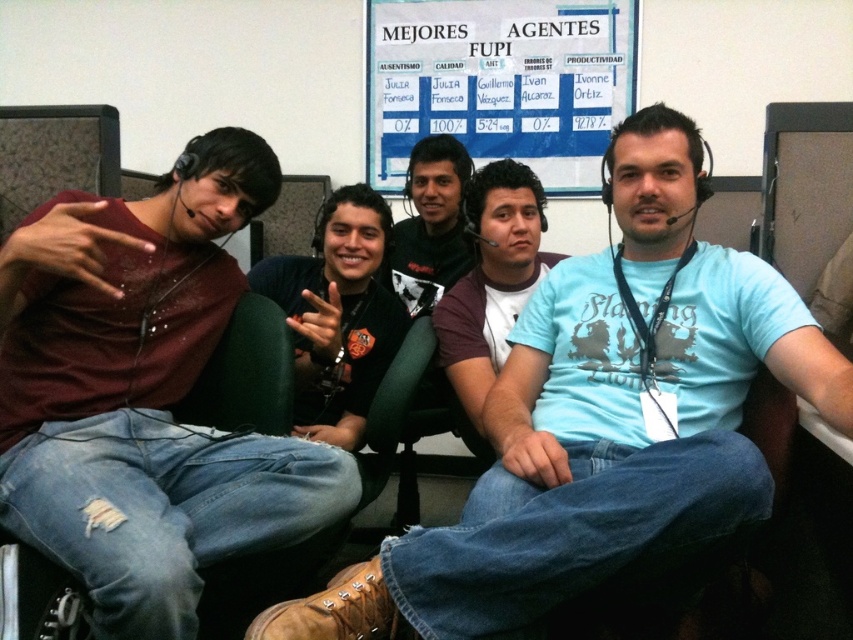
Which is behind, point (270, 621) or point (538, 61)?

The point (538, 61) is behind.

Where is `light blue t-shirt at center`? The width and height of the screenshot is (853, 640). light blue t-shirt at center is located at coordinates (589, 412).

Is point (361, 600) farther from camera compared to point (477, 22)?

No.

Where is `light blue t-shirt at center`? light blue t-shirt at center is located at coordinates (589, 412).

Is matte maroon shirt at left positioned before maroon fabric shirt at center?

Yes, matte maroon shirt at left is in front of maroon fabric shirt at center.

Between point (256, 156) and point (463, 189), which one is positioned behind?

Positioned behind is point (463, 189).

Which is behind, point (212, 284) or point (469, 298)?

The point (469, 298) is more distant.

You are a GUI agent. You are given a task and a screenshot of the screen. Output one action in this format:
    pyautogui.click(x=<x>, y=<y>)
    Task: Click on the matte maroon shirt at left
    Image resolution: width=853 pixels, height=640 pixels.
    Given the screenshot: What is the action you would take?
    pyautogui.click(x=144, y=394)

Can you confirm if light blue t-shirt at center is bigger than maroon fabric shirt at center?

Indeed, light blue t-shirt at center has a larger size compared to maroon fabric shirt at center.

Who is more forward, (514,436) or (460,401)?

Point (514,436) is in front.

Which is behind, point (564, 563) or point (503, 179)?

The point (503, 179) is more distant.

This screenshot has height=640, width=853. I want to click on light blue t-shirt at center, so click(x=589, y=412).